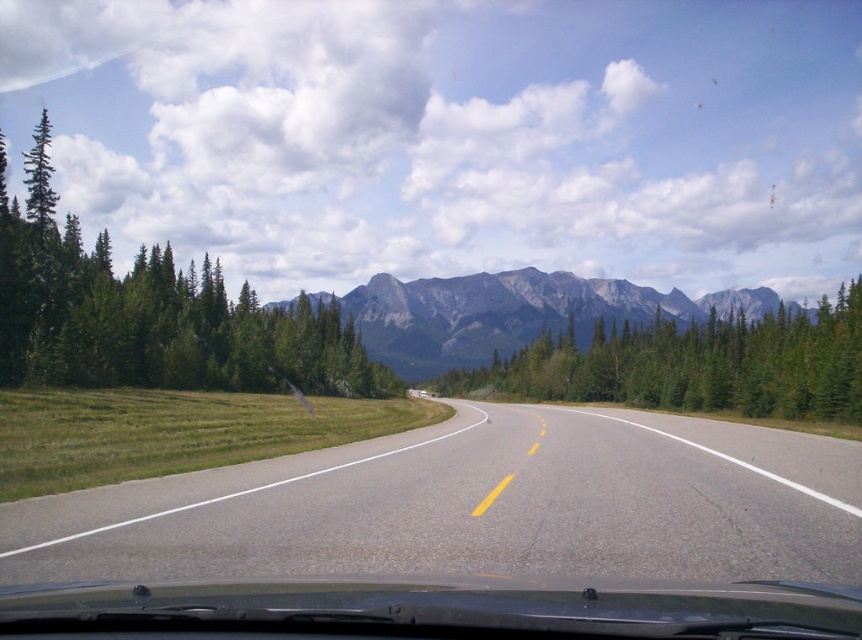
Does smooth asphalt highway at center appear on the left side of gray rocky mountain at center?

Indeed, smooth asphalt highway at center is positioned on the left side of gray rocky mountain at center.

Does point (609, 499) come in front of point (486, 284)?

Yes, point (609, 499) is closer to viewer.

Which is in front, point (223, 496) or point (422, 364)?

Point (223, 496) is more forward.

Where is `smooth asphalt highway at center`? smooth asphalt highway at center is located at coordinates (475, 506).

Locate an element on the screen. This screenshot has height=640, width=862. green matte tree at left is located at coordinates (152, 314).

Does green matte tree at left have a larger size compared to green textured pine trees at center?

Yes.

Does point (120, 365) come in front of point (747, 388)?

That is True.

The width and height of the screenshot is (862, 640). In order to click on green matte tree at left in this screenshot , I will do 152,314.

Can you confirm if smooth asphalt highway at center is positioned above green textured pine trees at center?

Incorrect, smooth asphalt highway at center is not positioned above green textured pine trees at center.

In the scene shown: Can you confirm if smooth asphalt highway at center is positioned to the right of green textured pine trees at center?

In fact, smooth asphalt highway at center is to the left of green textured pine trees at center.

This screenshot has height=640, width=862. Find the location of `smooth asphalt highway at center`. smooth asphalt highway at center is located at coordinates (475, 506).